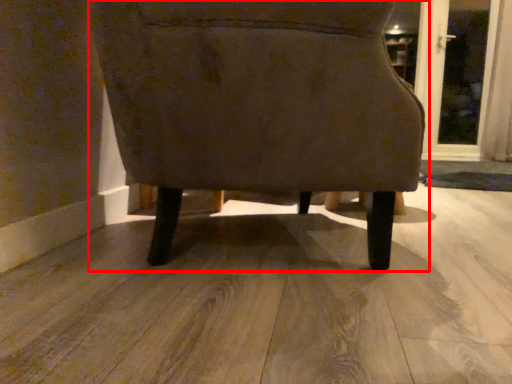
Question: From the image's perspective, where is chair (annotated by the red box) located relative to screen door?

Choices:
 (A) below
 (B) above

Answer: (A)